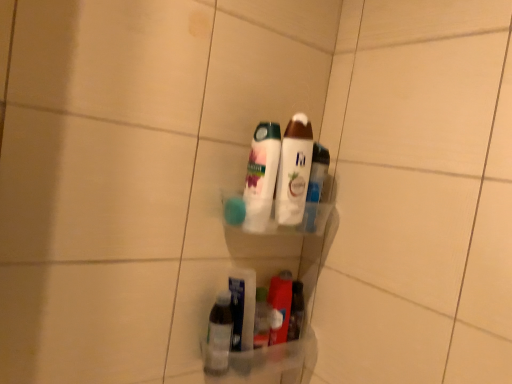
Question: Is white glossy lotion at center, which appears as the 1th bottle when viewed from the top, beside translucent plastic bottles at center, positioned as the 2th bottle in bottom-to-top order?

Choices:
 (A) no
 (B) yes

Answer: (B)

Question: From the image's perspective, is white glossy lotion at center, which appears as the 1th bottle when viewed from the top, located above translucent plastic bottles at center, positioned as the second bottle in top-to-bottom order?

Choices:
 (A) no
 (B) yes

Answer: (B)

Question: Is white glossy lotion at center, which appears as the 1th bottle when viewed from the top, taller than translucent plastic bottles at center, positioned as the 2th bottle in bottom-to-top order?

Choices:
 (A) no
 (B) yes

Answer: (B)

Question: Is white glossy lotion at center, which appears as the 1th bottle when viewed from the top, aimed at translucent plastic bottles at center, positioned as the 2th bottle in bottom-to-top order?

Choices:
 (A) yes
 (B) no

Answer: (B)

Question: Is translucent plastic bottles at center, positioned as the second bottle in top-to-bottom order, a part of white glossy lotion at center, the third bottle positioned from the bottom?

Choices:
 (A) no
 (B) yes

Answer: (A)

Question: Considering the relative sizes of white glossy lotion at center, the third bottle positioned from the bottom, and translucent plastic bottles at center, positioned as the 2th bottle in bottom-to-top order, in the image provided, is white glossy lotion at center, the third bottle positioned from the bottom, wider than translucent plastic bottles at center, positioned as the 2th bottle in bottom-to-top order,?

Choices:
 (A) no
 (B) yes

Answer: (A)

Question: Could you tell me if clear plastic bottle at lower center, the 3th bottle positioned from the top, is turned towards white glossy lotion at center, which appears as the 1th bottle when viewed from the top?

Choices:
 (A) no
 (B) yes

Answer: (A)

Question: Is clear plastic bottle at lower center, the 3th bottle positioned from the top, next to white glossy lotion at center, which appears as the 1th bottle when viewed from the top, and touching it?

Choices:
 (A) yes
 (B) no

Answer: (B)

Question: From the image's perspective, is clear plastic bottle at lower center, the 3th bottle positioned from the top, on white glossy lotion at center, the third bottle positioned from the bottom?

Choices:
 (A) no
 (B) yes

Answer: (A)

Question: Is clear plastic bottle at lower center, the 3th bottle positioned from the top, positioned beyond the bounds of white glossy lotion at center, the third bottle positioned from the bottom?

Choices:
 (A) no
 (B) yes

Answer: (B)

Question: Does clear plastic bottle at lower center, which is counted as the 1th bottle, starting from the bottom, appear on the left side of white glossy lotion at center, which appears as the 1th bottle when viewed from the top?

Choices:
 (A) no
 (B) yes

Answer: (B)

Question: From the image's perspective, does clear plastic bottle at lower center, the 3th bottle positioned from the top, appear lower than white glossy lotion at center, the third bottle positioned from the bottom?

Choices:
 (A) yes
 (B) no

Answer: (A)

Question: Can you confirm if clear plastic bottle at lower center, the 3th bottle positioned from the top, is positioned to the left of translucent plastic bottles at center, positioned as the 2th bottle in bottom-to-top order?

Choices:
 (A) yes
 (B) no

Answer: (A)